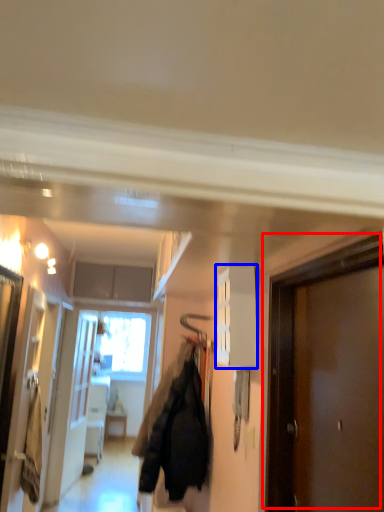
Question: Which point is closer to the camera, door (highlighted by a red box) or cabinetry (highlighted by a blue box)?

Choices:
 (A) door
 (B) cabinetry

Answer: (A)